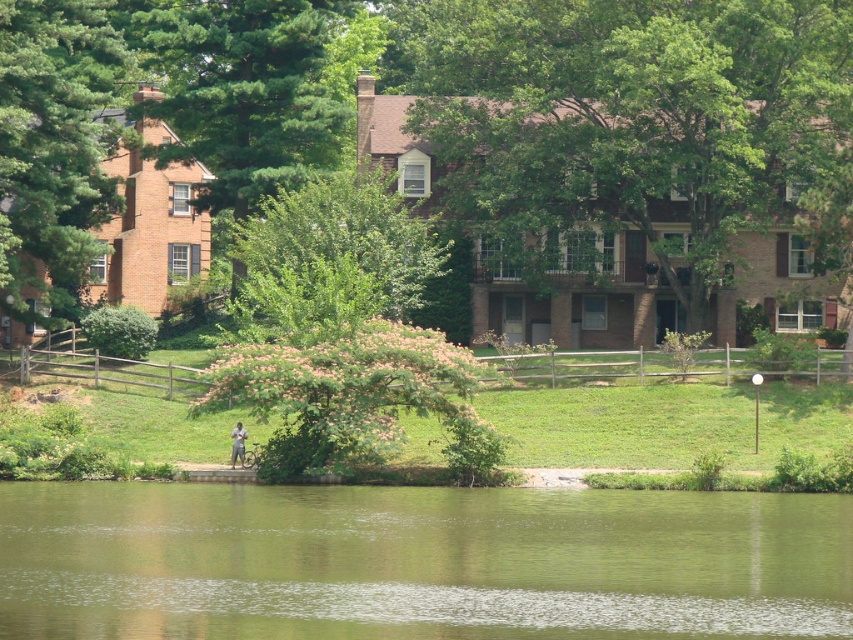
Question: Can you confirm if green leafy tree at upper center is positioned above pink fluffy tree at center?

Choices:
 (A) no
 (B) yes

Answer: (B)

Question: Does green liquid water at lower center have a larger size compared to green leafy tree at upper center?

Choices:
 (A) yes
 (B) no

Answer: (B)

Question: Which point is farther to the camera?

Choices:
 (A) (744, 84)
 (B) (376, 579)
 (C) (238, 451)

Answer: (A)

Question: Among these points, which one is nearest to the camera?

Choices:
 (A) (772, 554)
 (B) (676, 184)
 (C) (235, 435)

Answer: (A)

Question: Which object is positioned closest to the pink fluffy tree at center?

Choices:
 (A) green liquid water at lower center
 (B) green leafy tree at center

Answer: (A)

Question: Is green leafy tree at upper center positioned in front of pink fluffy tree at center?

Choices:
 (A) yes
 (B) no

Answer: (B)